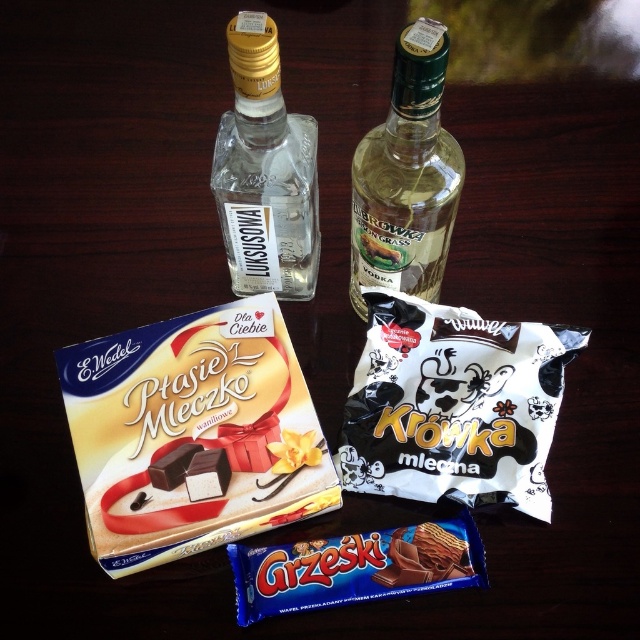
Which is more to the right, transparent glass bottle at upper center or chocolate wafer at center?

chocolate wafer at center

In the scene shown: Who is lower down, transparent glass bottle at upper center or chocolate wafer at center?

chocolate wafer at center

What do you see at coordinates (266, 172) in the screenshot?
I see `transparent glass bottle at upper center` at bounding box center [266, 172].

At what (x,y) coordinates should I click in order to perform the action: click on transparent glass bottle at upper center. Please return your answer as a coordinate pair (x, y). Looking at the image, I should click on (266, 172).

Between matte chocolate bar at center and chocolate wafer at lower center, which one has more height?

With more height is matte chocolate bar at center.

Is point (273, 342) less distant than point (452, 570)?

No, (273, 342) is behind (452, 570).

Who is more forward, (304,465) or (406,580)?

Point (406,580) is more forward.

What are the coordinates of `matte chocolate bar at center` in the screenshot? It's located at (193, 433).

Does transparent glass bottle at upper center have a lesser width compared to green glass bottle at center?

Incorrect, transparent glass bottle at upper center's width is not less than green glass bottle at center's.

Between transparent glass bottle at upper center and green glass bottle at center, which one is positioned higher?

green glass bottle at center is above.

Which is behind, point (244, 176) or point (358, 256)?

Positioned behind is point (358, 256).

Find the location of a particular element. transparent glass bottle at upper center is located at coordinates (266, 172).